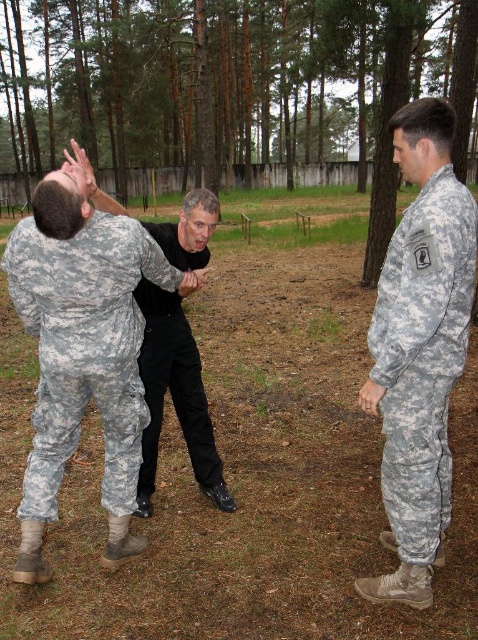
Question: Is camouflage fabric uniform at left in front of black matte shirt at center?

Choices:
 (A) no
 (B) yes

Answer: (B)

Question: Which object is the farthest from the camouflage fabric uniform at right?

Choices:
 (A) black matte hand at center
 (B) black matte pants at center
 (C) black matte shirt at center
 (D) camouflage fabric uniform at left

Answer: (D)

Question: Which point appears closest to the camera in this image?

Choices:
 (A) (177, 288)
 (B) (79, 164)
 (C) (96, 275)

Answer: (C)

Question: Is black matte shirt at center bigger than black matte hand at center?

Choices:
 (A) yes
 (B) no

Answer: (A)

Question: Does camouflage fabric uniform at right appear over black matte shirt at center?

Choices:
 (A) yes
 (B) no

Answer: (B)

Question: Which point is farther from the camera taking this photo?

Choices:
 (A) (392, 388)
 (B) (213, 204)

Answer: (B)